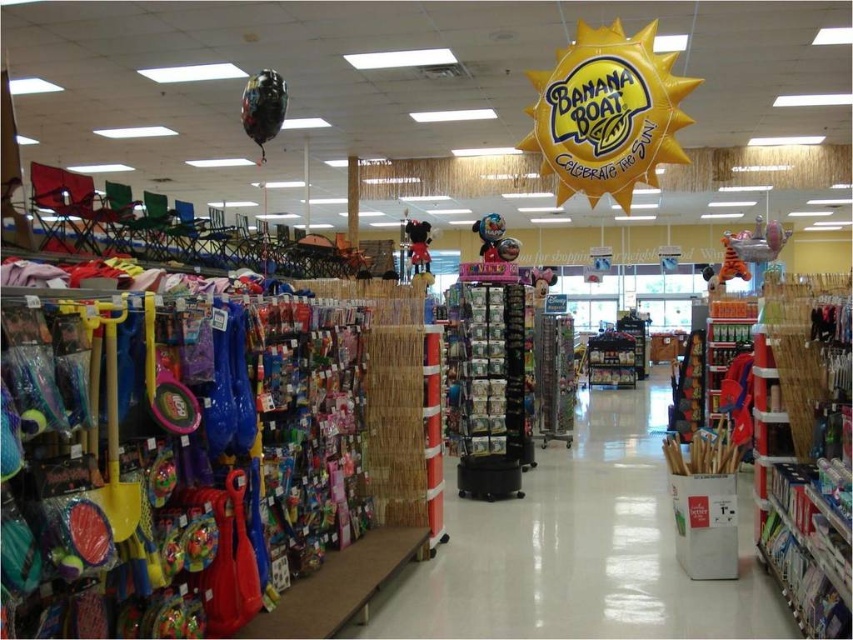
You are standing in the retail store and want to reach both the point at coordinates (410, 221) and the point at coordinates (535, 296). Which point is closer to you?

The point at coordinates (410, 221) is closer to you because it is further to the viewer than the point at coordinates (535, 296).

You are a customer looking to purchase a gift for a child. You see the plush red mickey mouse at center and the shiny metallic helmet at center. Which item is taller?

The plush red mickey mouse at center is taller than the shiny metallic helmet at center.

You are a customer in the store and want to buy a gift for a child. The store has a plush red mickey mouse at center and a shiny metallic helmet at center. Which item is bigger?

The plush red mickey mouse at center is larger in size compared to the shiny metallic helmet at center.